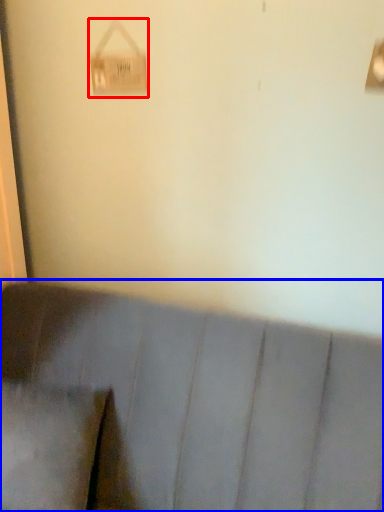
Question: Which point is further to the camera, lamp (highlighted by a red box) or furniture (highlighted by a blue box)?

Choices:
 (A) lamp
 (B) furniture

Answer: (A)